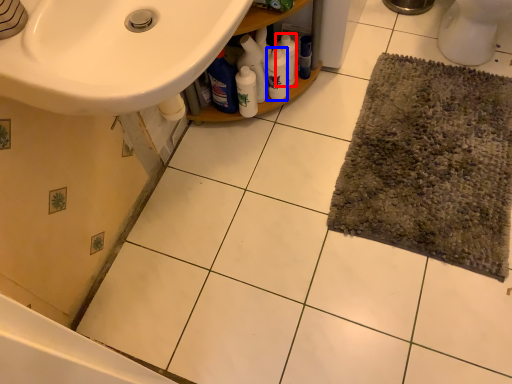
Question: Which object appears farthest to the camera in this image, cleaning product (highlighted by a red box) or cleaning product (highlighted by a blue box)?

Choices:
 (A) cleaning product
 (B) cleaning product

Answer: (A)